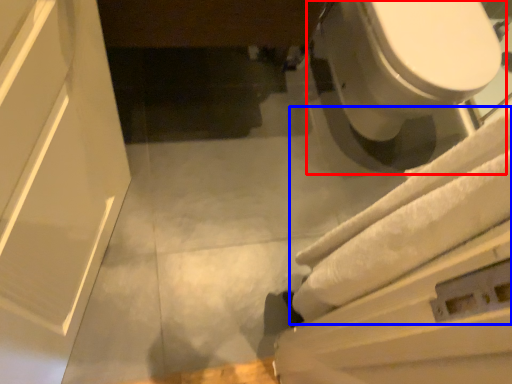
Question: Among these objects, which one is farthest to the camera, toilet (highlighted by a red box) or bath towel (highlighted by a blue box)?

Choices:
 (A) toilet
 (B) bath towel

Answer: (A)